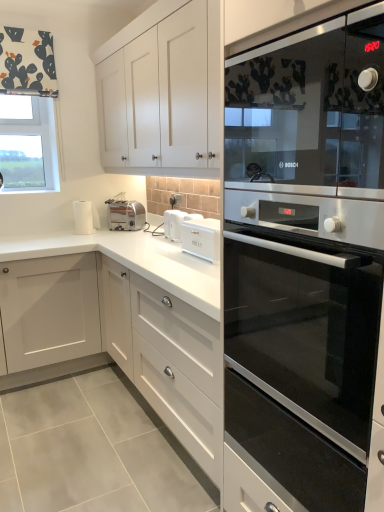
Question: Is clear glass window at upper left shorter than white plastic toaster at center, marked as the second appliance in a left-to-right arrangement?

Choices:
 (A) yes
 (B) no

Answer: (B)

Question: Could you tell me if clear glass window at upper left is facing white plastic toaster at center, the first appliance from the front?

Choices:
 (A) no
 (B) yes

Answer: (A)

Question: Can you confirm if clear glass window at upper left is positioned to the right of white plastic toaster at center, marked as the second appliance in a left-to-right arrangement?

Choices:
 (A) yes
 (B) no

Answer: (B)

Question: From the image's perspective, would you say clear glass window at upper left is shown under white plastic toaster at center, the first appliance from the front?

Choices:
 (A) yes
 (B) no

Answer: (B)

Question: Is clear glass window at upper left thinner than white plastic toaster at center, the first appliance positioned from the right?

Choices:
 (A) no
 (B) yes

Answer: (B)

Question: Is there a large distance between clear glass window at upper left and white plastic toaster at center, marked as the second appliance in a left-to-right arrangement?

Choices:
 (A) no
 (B) yes

Answer: (B)

Question: Does clear glass window at upper left come behind white glossy cabinet at lower right?

Choices:
 (A) no
 (B) yes

Answer: (B)

Question: Is clear glass window at upper left taller than white glossy cabinet at lower right?

Choices:
 (A) no
 (B) yes

Answer: (A)

Question: Does clear glass window at upper left have a smaller size compared to white glossy cabinet at lower right?

Choices:
 (A) no
 (B) yes

Answer: (B)

Question: From the image's perspective, is clear glass window at upper left above white glossy cabinet at lower right?

Choices:
 (A) no
 (B) yes

Answer: (B)

Question: Is clear glass window at upper left looking in the opposite direction of white glossy cabinet at lower right?

Choices:
 (A) yes
 (B) no

Answer: (B)

Question: Can you confirm if clear glass window at upper left is shorter than white glossy cabinet at lower right?

Choices:
 (A) no
 (B) yes

Answer: (B)

Question: From the image's perspective, would you say satin silver toaster at center, marked as the first appliance in a back-to-front arrangement, is shown under black glass oven at right?

Choices:
 (A) yes
 (B) no

Answer: (B)